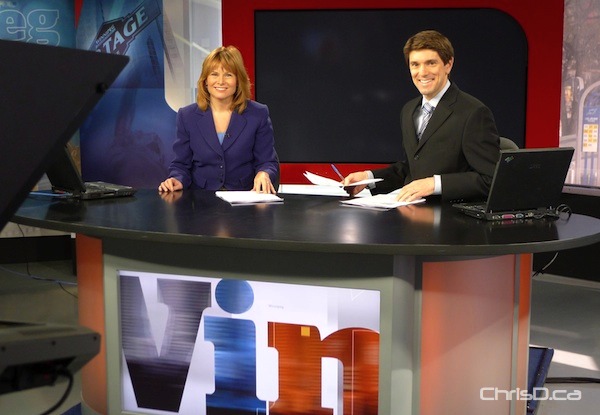
Locate an element on the screen. This screenshot has width=600, height=415. pen is located at coordinates (336, 172).